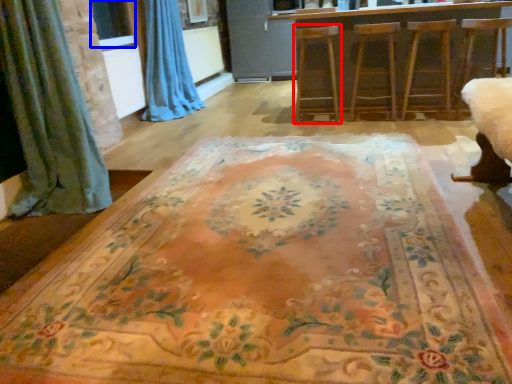
Question: Which point is further to the camera, armchair (highlighted by a red box) or window screen (highlighted by a blue box)?

Choices:
 (A) armchair
 (B) window screen

Answer: (B)